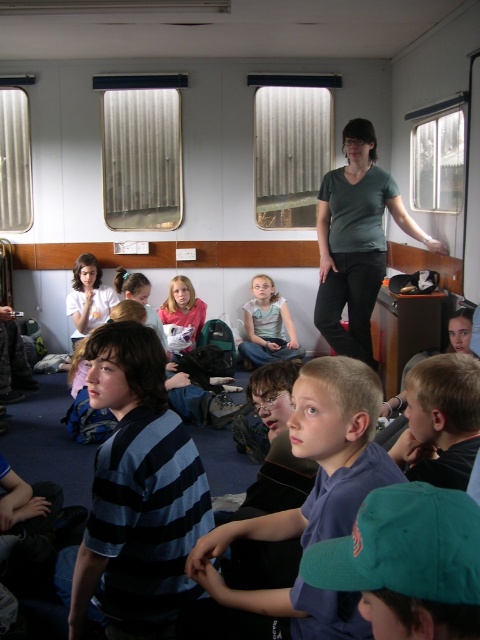
Question: Which point is farther to the camera?

Choices:
 (A) (256, 298)
 (B) (167, 310)
 (C) (368, 488)

Answer: (A)

Question: Considering the real-world distances, which object is closest to the matte pink shirt at center?

Choices:
 (A) striped cotton shirt at center
 (B) light blue fabric shirt at center

Answer: (B)

Question: Observing the image, what is the correct spatial positioning of light blue fabric shirt at center in reference to matte pink shirt at center?

Choices:
 (A) below
 (B) above

Answer: (A)

Question: Among these objects, which one is farthest from the camera?

Choices:
 (A) blue striped shirt at center
 (B) blonde hair at center

Answer: (B)

Question: Is blue striped shirt at center smaller than light blue fabric shirt at center?

Choices:
 (A) no
 (B) yes

Answer: (A)

Question: Is the position of blue striped shirt at center more distant than that of blonde hair at center?

Choices:
 (A) yes
 (B) no

Answer: (B)